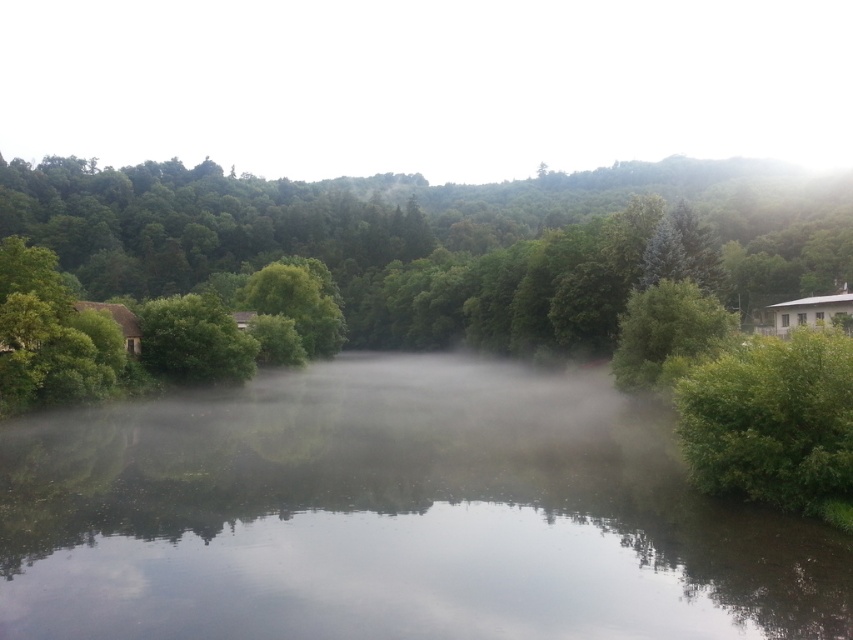
You are an environmental scientist assessing the landscape. You need to determine which object occupies more space in the scene between the transparent misty river at center and the green leafy bush at right. Based on the scene, which one is larger?

The transparent misty river at center has a larger size compared to the green leafy bush at right, so the river occupies more space in the scene.

You are an environmental scientist assessing the vegetation density in the scene. Which object, the green leafy bush at right or the green matte tree at center, occupies more horizontal space in the image?

The green leafy bush at right has a lesser width compared to the green matte tree at center, so the green matte tree at center occupies more horizontal space.

Looking at this image, you are standing near the water in the image and want to cross to the other side. The transparent misty river at center and the green leafy bush at right are in your path. Which object is shorter, making it easier to step over?

The transparent misty river at center is not as tall as the green leafy bush at right, so the transparent misty river at center is shorter and easier to step over.